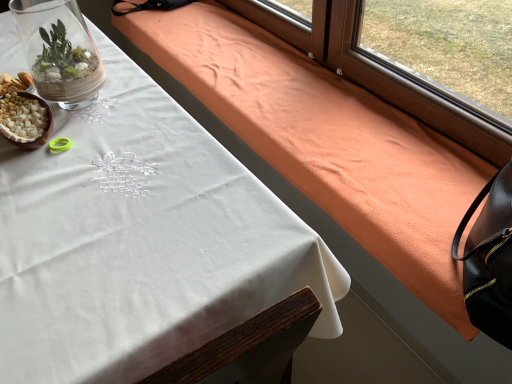
The height and width of the screenshot is (384, 512). Find the location of `orange suede blanket at upper right`. orange suede blanket at upper right is located at coordinates (336, 132).

Based on the photo, what is the approximate width of clear glass terrarium at upper left?

The width of clear glass terrarium at upper left is 6.86 inches.

The height and width of the screenshot is (384, 512). Describe the element at coordinates (59, 51) in the screenshot. I see `clear glass terrarium at upper left` at that location.

The image size is (512, 384). In order to click on white cloth at upper left in this screenshot , I will do `click(140, 241)`.

From a real-world perspective, which object stands above the other?

orange suede blanket at upper right is physically above.

Is orange suede blanket at upper right facing away from white cloth at upper left?

No, white cloth at upper left is not at the back of orange suede blanket at upper right.

Which object is further away from the camera, orange suede blanket at upper right or white cloth at upper left?

orange suede blanket at upper right is more distant.

Is orange suede blanket at upper right spatially inside white cloth at upper left, or outside of it?

orange suede blanket at upper right is not inside white cloth at upper left, it's outside.

From a real-world perspective, is orange suede blanket at upper right physically below white matte bowl at lower left?

Yes, from a real-world perspective, orange suede blanket at upper right is below white matte bowl at lower left.

Is orange suede blanket at upper right facing away from white matte bowl at lower left?

Result: That's not correct — orange suede blanket at upper right is not looking away from white matte bowl at lower left.

The width and height of the screenshot is (512, 384). In order to click on food behind the orange suede blanket at upper right in this screenshot , I will do `click(22, 118)`.

Consider the image. Between white cloth at upper left and clear glass terrarium at upper left, which one is positioned behind?

Positioned behind is clear glass terrarium at upper left.

Which is more to the left, white cloth at upper left or clear glass terrarium at upper left?

From the viewer's perspective, white cloth at upper left appears more on the left side.

From the image's perspective, is white cloth at upper left below clear glass terrarium at upper left?

Yes.

Can you see white cloth at upper left touching clear glass terrarium at upper left?

No, white cloth at upper left is not beside clear glass terrarium at upper left.

Is white cloth at upper left bigger or smaller than white matte bowl at lower left?

white cloth at upper left is bigger than white matte bowl at lower left.

Are white cloth at upper left and white matte bowl at lower left located far from each other?

white cloth at upper left is near white matte bowl at lower left, not far away.

How far apart are white cloth at upper left and white matte bowl at lower left?

The distance of white cloth at upper left from white matte bowl at lower left is 12.88 inches.

Identify the location of food behind the white cloth at upper left. (22, 118).

Which of these two, white cloth at upper left or orange suede blanket at upper right, is smaller?

With smaller size is orange suede blanket at upper right.

From a real-world perspective, which is physically above, white cloth at upper left or orange suede blanket at upper right?

orange suede blanket at upper right is physically above.

Between point (19, 192) and point (422, 222), which one is positioned behind?

The point (422, 222) is more distant.

Is there a large distance between orange suede blanket at upper right and clear glass terrarium at upper left?

No, orange suede blanket at upper right is in close proximity to clear glass terrarium at upper left.

Between orange suede blanket at upper right and clear glass terrarium at upper left, which one has larger size?

orange suede blanket at upper right is bigger.

Is orange suede blanket at upper right not within clear glass terrarium at upper left?

Yes, orange suede blanket at upper right is outside of clear glass terrarium at upper left.

Can you tell me how much orange suede blanket at upper right and clear glass terrarium at upper left differ in facing direction?

1.02 degrees.

Is white matte bowl at lower left at the right side of white cloth at upper left?

Yes.

I want to click on table below the white matte bowl at lower left (from the image's perspective), so click(x=140, y=241).

What's the angular difference between white matte bowl at lower left and white cloth at upper left's facing directions?

0.261 degrees separate the facing orientations of white matte bowl at lower left and white cloth at upper left.

From the image's perspective, which object appears higher, white matte bowl at lower left or white cloth at upper left?

From the image's view, white matte bowl at lower left is above.

The height and width of the screenshot is (384, 512). What are the coordinates of `table that appears below the orange suede blanket at upper right (from the image's perspective)` in the screenshot? It's located at (140, 241).

This screenshot has height=384, width=512. What are the coordinates of `blanket in front of the white matte bowl at lower left` in the screenshot? It's located at (336, 132).

Which object lies nearer to the anchor point clear glass terrarium at upper left, white matte bowl at lower left or orange suede blanket at upper right?

Among the two, white matte bowl at lower left is located nearer to clear glass terrarium at upper left.

Based on their spatial positions, is orange suede blanket at upper right or clear glass terrarium at upper left closer to white matte bowl at lower left?

clear glass terrarium at upper left is positioned closer to the anchor white matte bowl at lower left.

From the image, which object appears to be nearer to white cloth at upper left, orange suede blanket at upper right or white matte bowl at lower left?

Among the two, white matte bowl at lower left is located nearer to white cloth at upper left.

Considering their positions, is white matte bowl at lower left positioned closer to orange suede blanket at upper right than white cloth at upper left?

white cloth at upper left lies closer to orange suede blanket at upper right than the other object.

From the image, which object appears to be nearer to white matte bowl at lower left, white cloth at upper left or orange suede blanket at upper right?

white cloth at upper left is positioned closer to the anchor white matte bowl at lower left.

From the image, which object appears to be nearer to white matte bowl at lower left, clear glass terrarium at upper left or white cloth at upper left?

white cloth at upper left is positioned closer to the anchor white matte bowl at lower left.

From the picture: Estimate the real-world distances between objects in this image. Which object is further from white matte bowl at lower left, orange suede blanket at upper right or white cloth at upper left?

orange suede blanket at upper right is positioned further to the anchor white matte bowl at lower left.

Looking at the image, which one is located further to white cloth at upper left, orange suede blanket at upper right or clear glass terrarium at upper left?

clear glass terrarium at upper left is further to white cloth at upper left.

You are a GUI agent. You are given a task and a screenshot of the screen. Output one action in this format:
    pyautogui.click(x=<x>, y=<y>)
    Task: Click on the glass vase located between white cloth at upper left and white matte bowl at lower left in the depth direction
    This screenshot has width=512, height=384.
    Given the screenshot: What is the action you would take?
    click(x=59, y=51)

Image resolution: width=512 pixels, height=384 pixels. What are the coordinates of `glass vase situated between white cloth at upper left and orange suede blanket at upper right from left to right` in the screenshot? It's located at (59, 51).

Where is `food situated between white cloth at upper left and orange suede blanket at upper right from left to right`? The height and width of the screenshot is (384, 512). food situated between white cloth at upper left and orange suede blanket at upper right from left to right is located at coordinates (22, 118).

Identify the location of glass vase between white matte bowl at lower left and orange suede blanket at upper right from left to right. This screenshot has height=384, width=512. (59, 51).